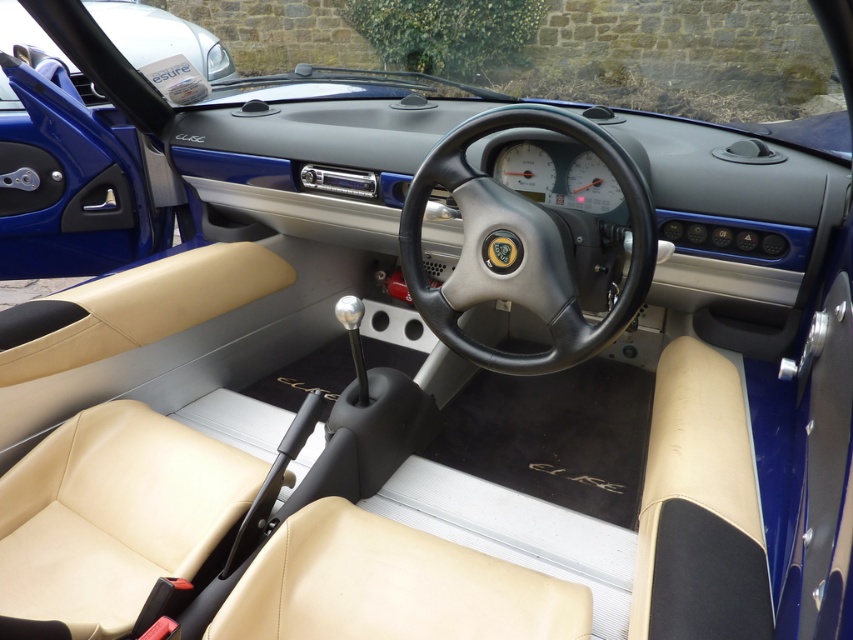
You are sitting in the driver seat of the Lotus Elise. You want to adjust the temperature controls. The controls are located on the white plastic gauge at center. To reach them, do you need to move your hand up or down from the black leather steering wheel at center?

The black leather steering wheel at center is below the white plastic gauge at center, so you need to move your hand upward from the black leather steering wheel at center to reach the white plastic gauge at center.

You are sitting in the driver seat of the Lotus Elise sports car and want to check the white plastic gauge at center. However, the matte black steering wheel at center is blocking your view. Can you adjust the steering wheel to see the gauge?

The white plastic gauge at center is behind the matte black steering wheel at center, so you can tilt or adjust the steering wheel to get a clear view of the gauge.